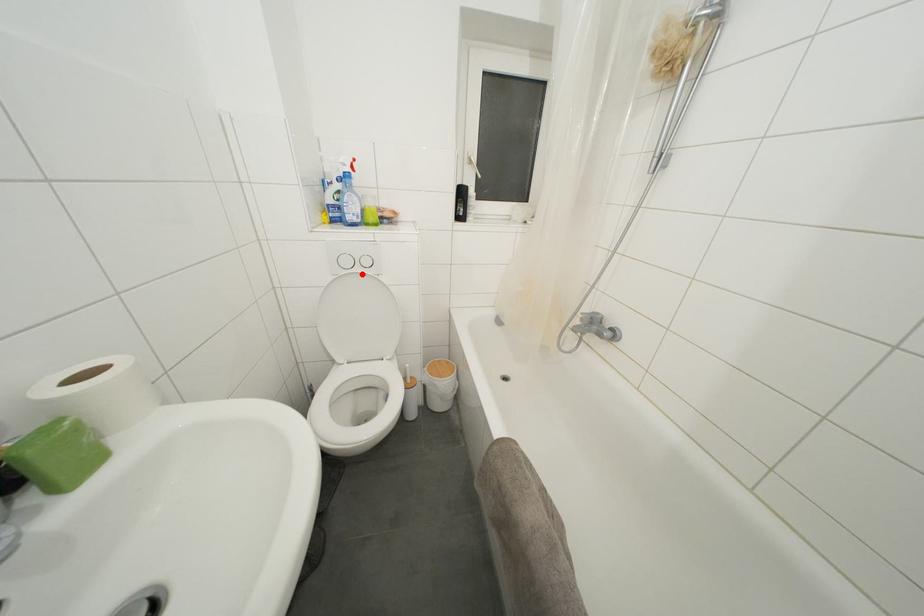
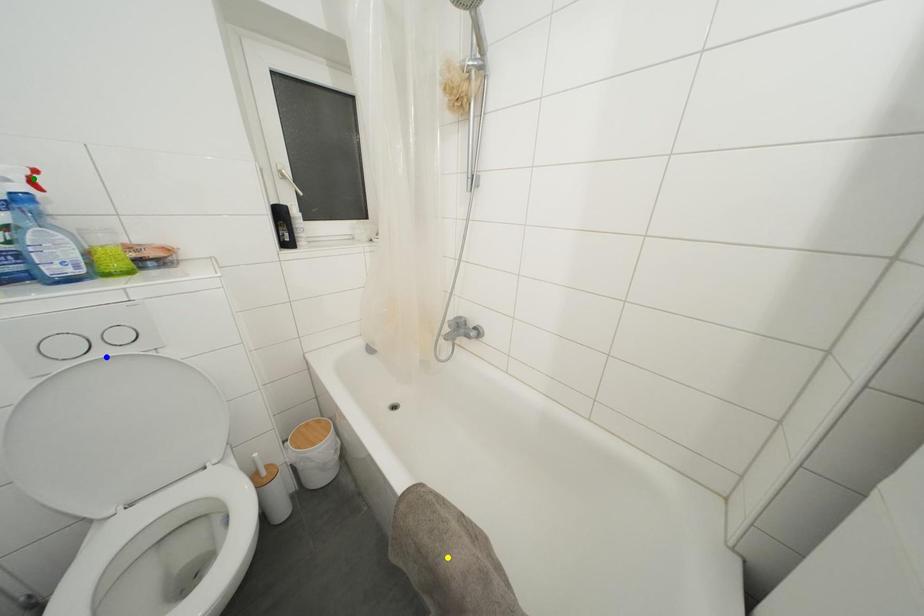
Question: I am providing you with two images of the same scene from different viewpoints. A red point is marked on the first image. You are given multiple points on the second image. Which spot in image 2 lines up with the point in image 1?

Choices:
 (A) yellow point
 (B) green point
 (C) blue point

Answer: (C)